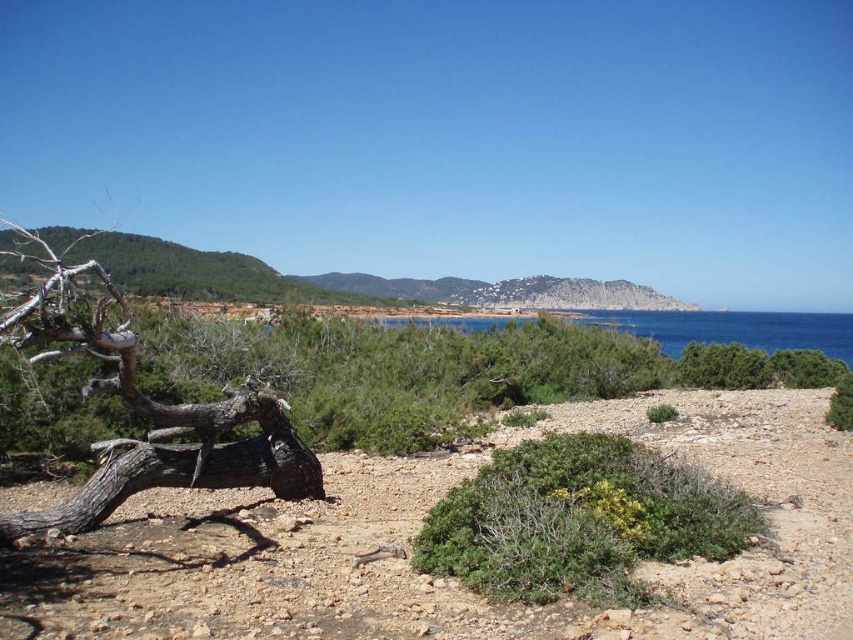
Does green shrub at center lie behind dark gray bark tree at left?

No, it is in front of dark gray bark tree at left.

Is green shrub at center smaller than dark gray bark tree at left?

Yes, green shrub at center is smaller than dark gray bark tree at left.

The height and width of the screenshot is (640, 853). Describe the element at coordinates (579, 520) in the screenshot. I see `green shrub at center` at that location.

Where is `green shrub at center`? green shrub at center is located at coordinates (579, 520).

Between point (715, 420) and point (210, 444), which one is positioned behind?

The point (715, 420) is behind.

Can you confirm if brown rocky beach at lower center is positioned above dark gray bark tree at left?

No, brown rocky beach at lower center is not above dark gray bark tree at left.

Who is more forward, (796, 547) or (21, 307)?

Point (21, 307)

The height and width of the screenshot is (640, 853). Identify the location of brown rocky beach at lower center. (450, 579).

Which is in front, point (643, 563) or point (469, 528)?

Point (643, 563)

Can you confirm if brown rocky beach at lower center is shorter than green shrub at center?

Yes, brown rocky beach at lower center is shorter than green shrub at center.

Locate an element on the screen. This screenshot has height=640, width=853. brown rocky beach at lower center is located at coordinates (450, 579).